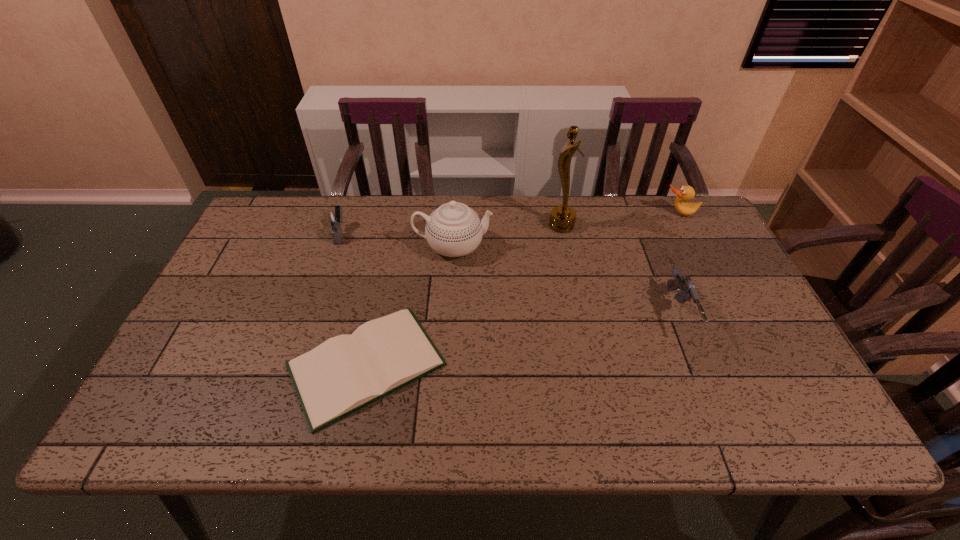
Find the location of a particular element. The width and height of the screenshot is (960, 540). the tallest object is located at coordinates (562, 219).

Locate an element on the screen. The height and width of the screenshot is (540, 960). the third object from right to left is located at coordinates (562, 219).

Locate an element on the screen. This screenshot has width=960, height=540. the second tallest object is located at coordinates (454, 229).

At what (x,y) coordinates should I click in order to perform the action: click on igniter. Please return your answer as a coordinate pair (x, y). The image size is (960, 540). Looking at the image, I should click on (332, 217).

What are the coordinates of `duck` in the screenshot? It's located at (686, 193).

The image size is (960, 540). Identify the location of the second object from right to left. (682, 282).

The height and width of the screenshot is (540, 960). I want to click on hardback book, so click(347, 372).

Image resolution: width=960 pixels, height=540 pixels. What are the coordinates of `free space located 0.290m on the front-facing side of the tallest object` in the screenshot? It's located at (459, 226).

Image resolution: width=960 pixels, height=540 pixels. What are the coordinates of `free space located 0.210m on the front-facing side of the tallest object` in the screenshot? It's located at (484, 226).

Locate an element on the screen. The width and height of the screenshot is (960, 540). free location located 0.280m on the front-facing side of the tallest object is located at coordinates (462, 226).